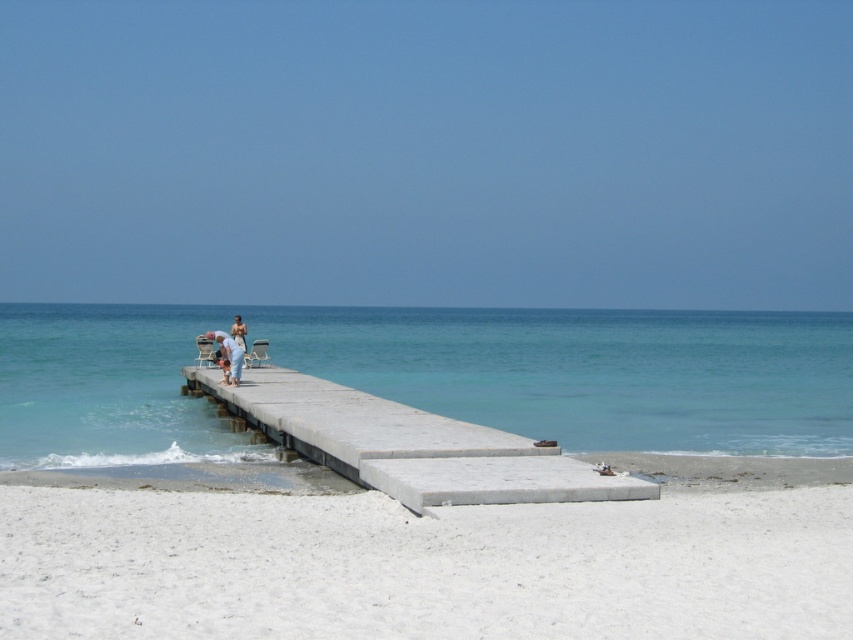
Is concrete at center taller than light blue denim jeans at center?

No.

Can you confirm if concrete at center is bigger than light blue denim jeans at center?

Yes.

Identify the location of concrete at center. (409, 445).

Does white sandy beach at lower center have a lesser width compared to clear blue water at center?

Indeed, white sandy beach at lower center has a lesser width compared to clear blue water at center.

Is point (155, 621) positioned in front of point (41, 371)?

Yes, point (155, 621) is closer to viewer.

This screenshot has width=853, height=640. What are the coordinates of `white sandy beach at lower center` in the screenshot? It's located at [x=424, y=566].

Does metallic silver beach chair at center have a larger size compared to beige fabric beach chair at center?

Indeed, metallic silver beach chair at center has a larger size compared to beige fabric beach chair at center.

Between metallic silver beach chair at center and beige fabric beach chair at center, which one appears on the right side from the viewer's perspective?

beige fabric beach chair at center is more to the right.

This screenshot has height=640, width=853. What are the coordinates of `metallic silver beach chair at center` in the screenshot? It's located at (206, 349).